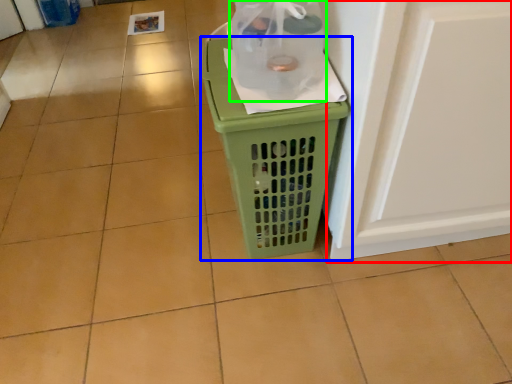
Question: Considering the real-world distances, which object is closest to screen door (highlighted by a red box)? waste container (highlighted by a blue box) or bottle (highlighted by a green box).

Choices:
 (A) waste container
 (B) bottle

Answer: (A)